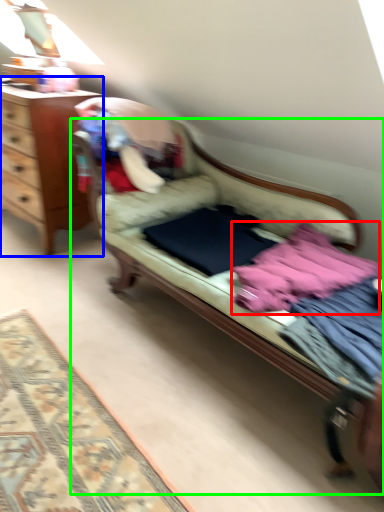
Question: Considering the real-world distances, which object is closest to baby clothe (highlighted by a red box)? desk (highlighted by a blue box) or studio couch (highlighted by a green box).

Choices:
 (A) desk
 (B) studio couch

Answer: (B)